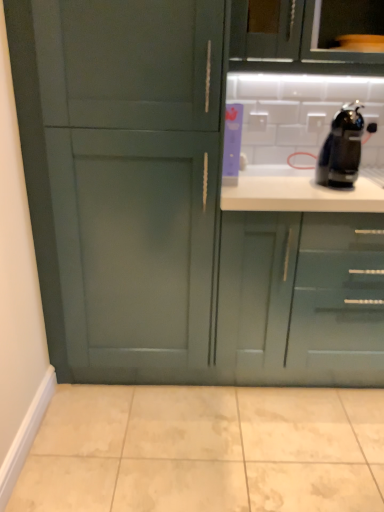
I want to click on vacant space situated above beige marble tile at lower center (from a real-world perspective), so click(x=207, y=432).